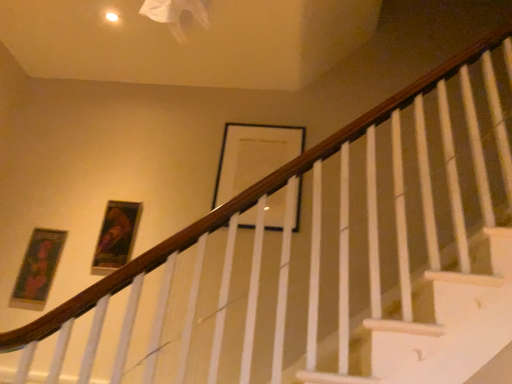
Question: Is matte gold picture frame at left, the first picture frame in the left-to-right sequence, next to wooden framed portrait at upper left, which ranks as the 2th picture frame in right-to-left order, and touching it?

Choices:
 (A) no
 (B) yes

Answer: (A)

Question: Can you confirm if matte gold picture frame at left, the first picture frame in the left-to-right sequence, is shorter than wooden framed portrait at upper left, which ranks as the 2th picture frame in right-to-left order?

Choices:
 (A) no
 (B) yes

Answer: (A)

Question: Is matte gold picture frame at left, which is the third picture frame from right to left, thinner than wooden framed portrait at upper left, which appears as the 2th picture frame when viewed from the left?

Choices:
 (A) yes
 (B) no

Answer: (A)

Question: From a real-world perspective, does matte gold picture frame at left, which is the third picture frame from right to left, stand above wooden framed portrait at upper left, which ranks as the 2th picture frame in right-to-left order?

Choices:
 (A) yes
 (B) no

Answer: (B)

Question: Could wooden framed portrait at upper left, which ranks as the 2th picture frame in right-to-left order, be considered to be inside matte gold picture frame at left, which is the third picture frame from right to left?

Choices:
 (A) yes
 (B) no

Answer: (B)

Question: From a real-world perspective, relative to matte gold picture frame at left, which is the third picture frame from right to left, is wooden framed portrait at upper left, which appears as the 2th picture frame when viewed from the left, vertically above or below?

Choices:
 (A) below
 (B) above

Answer: (B)

Question: From the image's perspective, is wooden framed portrait at upper left, which ranks as the 2th picture frame in right-to-left order, located above or below matte gold picture frame at left, which is the third picture frame from right to left?

Choices:
 (A) above
 (B) below

Answer: (A)

Question: Does point (112, 261) appear closer or farther from the camera than point (62, 231)?

Choices:
 (A) farther
 (B) closer

Answer: (B)

Question: Is wooden framed portrait at upper left, which ranks as the 2th picture frame in right-to-left order, bigger or smaller than matte gold picture frame at left, the first picture frame in the left-to-right sequence?

Choices:
 (A) small
 (B) big

Answer: (B)

Question: From a real-world perspective, is black matte picture frame at upper center, which appears as the 1th picture frame when viewed from the right, physically located above or below wooden framed portrait at upper left, which ranks as the 2th picture frame in right-to-left order?

Choices:
 (A) above
 (B) below

Answer: (A)

Question: Which is correct: black matte picture frame at upper center, which appears as the 1th picture frame when viewed from the right, is inside wooden framed portrait at upper left, which ranks as the 2th picture frame in right-to-left order, or outside of it?

Choices:
 (A) outside
 (B) inside

Answer: (A)

Question: Is black matte picture frame at upper center, which appears as the 1th picture frame when viewed from the right, taller or shorter than wooden framed portrait at upper left, which ranks as the 2th picture frame in right-to-left order?

Choices:
 (A) tall
 (B) short

Answer: (A)

Question: Considering their positions, is black matte picture frame at upper center, which appears as the 1th picture frame when viewed from the right, located in front of or behind wooden framed portrait at upper left, which ranks as the 2th picture frame in right-to-left order?

Choices:
 (A) front
 (B) behind

Answer: (B)

Question: Is point (244, 145) positioned closer to the camera than point (42, 281)?

Choices:
 (A) farther
 (B) closer

Answer: (A)

Question: In the image, is black matte picture frame at upper center, which appears as the 1th picture frame when viewed from the right, positioned in front of or behind matte gold picture frame at left, the first picture frame in the left-to-right sequence?

Choices:
 (A) behind
 (B) front

Answer: (A)